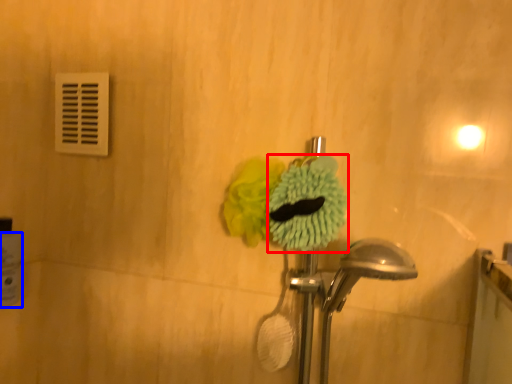
Question: Which object appears closest to the camera in this image, flower (highlighted by a red box) or toilet paper (highlighted by a blue box)?

Choices:
 (A) flower
 (B) toilet paper

Answer: (A)